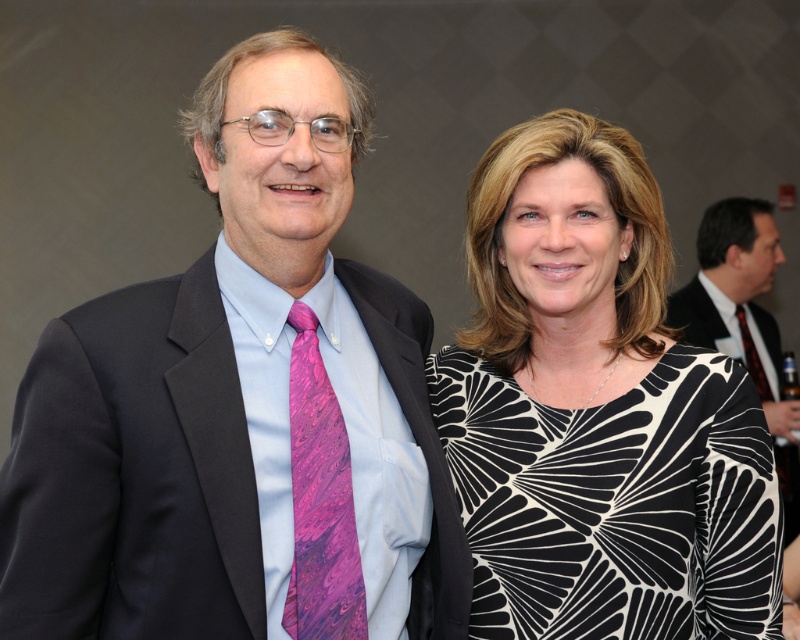
Can you confirm if matte black suit at center is positioned below pink silk tie at right?

Yes.

Does matte black suit at center appear on the left side of pink silk tie at right?

Correct, you'll find matte black suit at center to the left of pink silk tie at right.

At what (x,y) coordinates should I click in order to perform the action: click on matte black suit at center. Please return your answer as a coordinate pair (x, y). The height and width of the screenshot is (640, 800). Looking at the image, I should click on (132, 474).

You are a GUI agent. You are given a task and a screenshot of the screen. Output one action in this format:
    pyautogui.click(x=<x>, y=<y>)
    Task: Click on the matte black suit at center
    The width and height of the screenshot is (800, 640).
    Given the screenshot: What is the action you would take?
    pyautogui.click(x=132, y=474)

Is black printed dress at right above black silk business suit at right?

Indeed, black printed dress at right is positioned over black silk business suit at right.

Does black printed dress at right have a greater width compared to black silk business suit at right?

No.

Between point (574, 627) and point (674, 323), which one is positioned behind?

Positioned behind is point (674, 323).

Locate an element on the screen. black printed dress at right is located at coordinates (598, 412).

Is black silk business suit at right further to camera compared to pink silk tie at right?

No, black silk business suit at right is in front of pink silk tie at right.

Can you confirm if black silk business suit at right is wider than pink silk tie at right?

Indeed, black silk business suit at right has a greater width compared to pink silk tie at right.

Measure the distance between black silk business suit at right and camera.

black silk business suit at right is 12.99 feet away from camera.

Locate an element on the screen. black silk business suit at right is located at coordinates (704, 321).